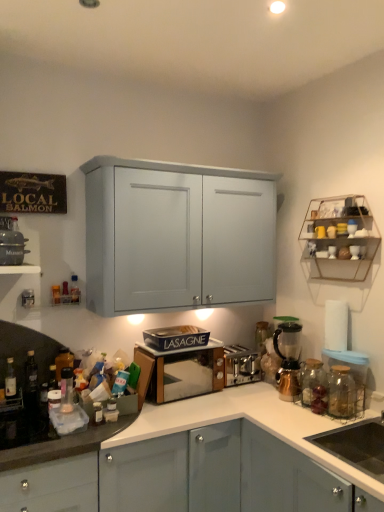
What are the coordinates of `free space in front of wooden microwave at center, positioned as the 2th appliance in front-to-back order` in the screenshot? It's located at (184, 414).